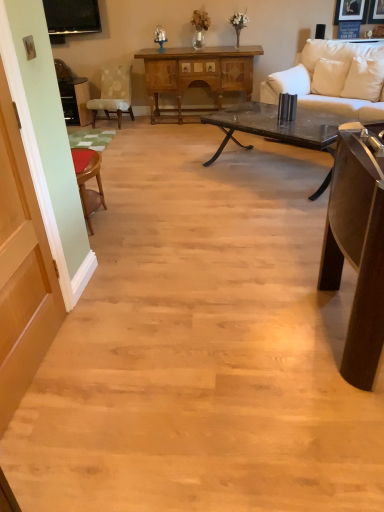
Find the location of `empty space that is in between black glass coffee table at center and transparent glass door at left`. empty space that is in between black glass coffee table at center and transparent glass door at left is located at coordinates click(x=191, y=248).